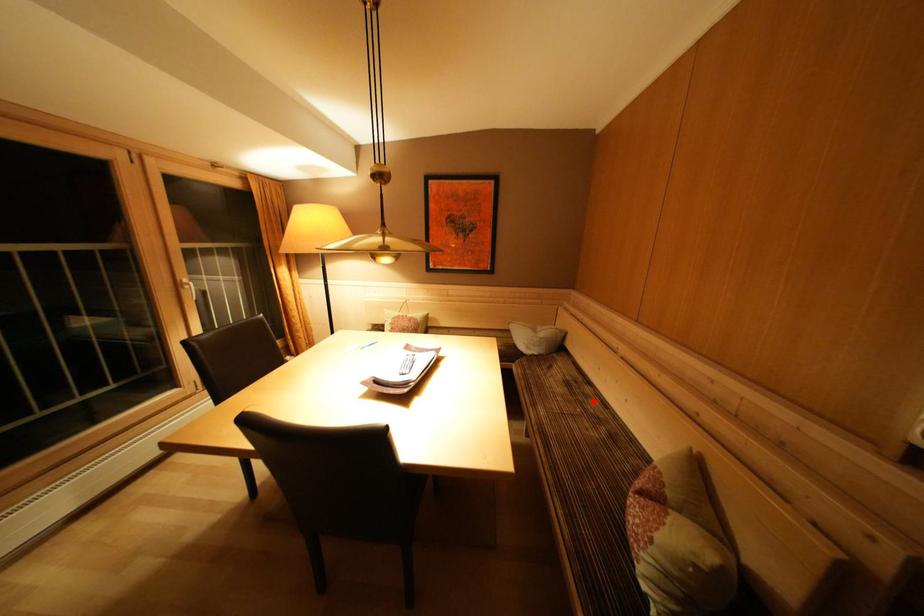
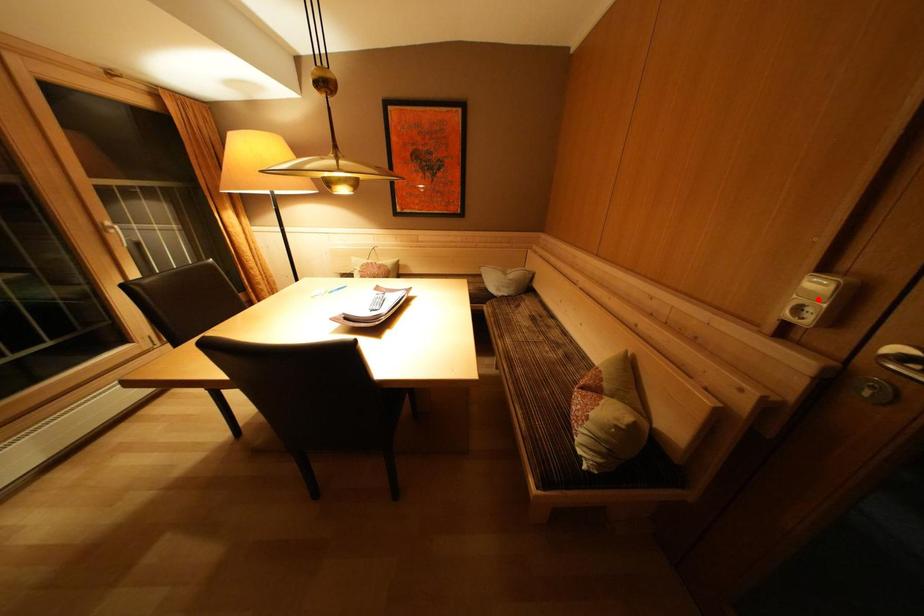
I am providing you with two images of the same scene from different viewpoints. A red point is marked on the first image and another point is marked on the second image. Is the red point in image1 aligned with the point shown in image2?

No